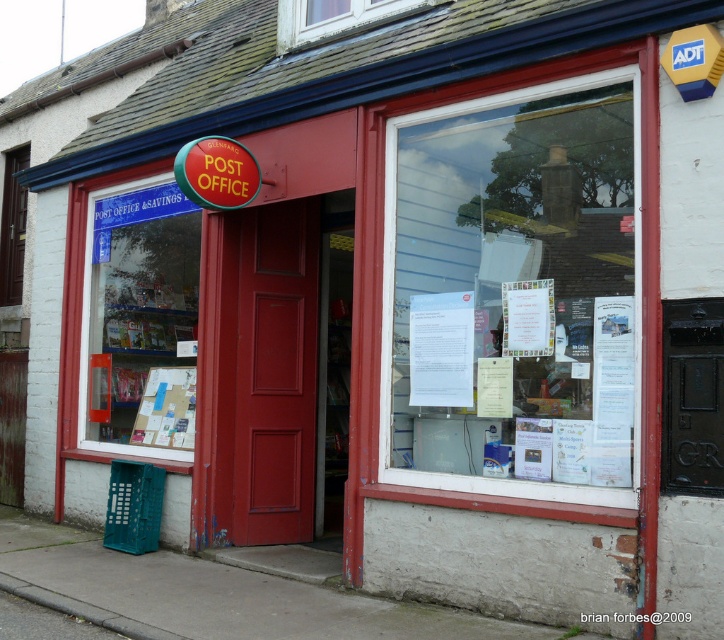
Which is more to the right, orange plastic sign at upper center or cardboard bulletin board at center?

orange plastic sign at upper center

Between orange plastic sign at upper center and cardboard bulletin board at center, which one has more height?

cardboard bulletin board at center is taller.

Is point (251, 188) positioned before point (164, 374)?

Yes, point (251, 188) is in front of point (164, 374).

Where is `orange plastic sign at upper center`? orange plastic sign at upper center is located at coordinates (216, 172).

Between point (475, 308) and point (230, 154), which one is positioned in front?

Point (475, 308)

Which is more to the right, transparent glass window at center or orange plastic sign at upper center?

From the viewer's perspective, transparent glass window at center appears more on the right side.

Which is behind, point (531, 262) or point (235, 189)?

The point (235, 189) is more distant.

I want to click on transparent glass window at center, so click(513, 292).

Is the position of gray concrete pavement at lower center more distant than that of clear glass window at upper center?

No.

Which is in front, point (185, 598) or point (279, 17)?

Point (185, 598)

The height and width of the screenshot is (640, 724). What are the coordinates of `gray concrete pavement at lower center` in the screenshot? It's located at (201, 596).

You are a GUI agent. You are given a task and a screenshot of the screen. Output one action in this format:
    pyautogui.click(x=<x>, y=<y>)
    Task: Click on the gray concrete pavement at lower center
    This screenshot has width=724, height=640.
    Given the screenshot: What is the action you would take?
    pyautogui.click(x=201, y=596)